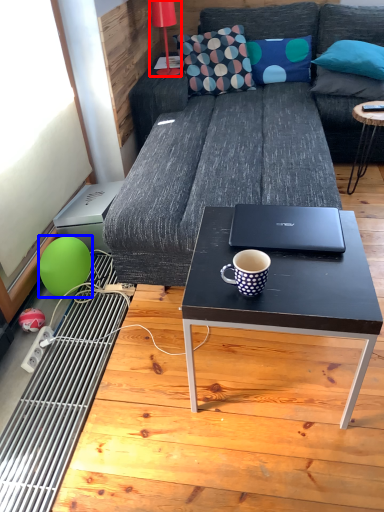
Question: Which object is further to the camera taking this photo, lamp (highlighted by a red box) or teal (highlighted by a blue box)?

Choices:
 (A) lamp
 (B) teal

Answer: (A)